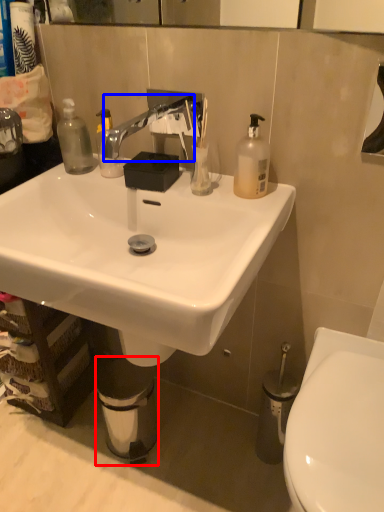
Question: Which point is closer to the camera, trash bin/can (highlighted by a red box) or faucet (highlighted by a blue box)?

Choices:
 (A) trash bin/can
 (B) faucet

Answer: (B)